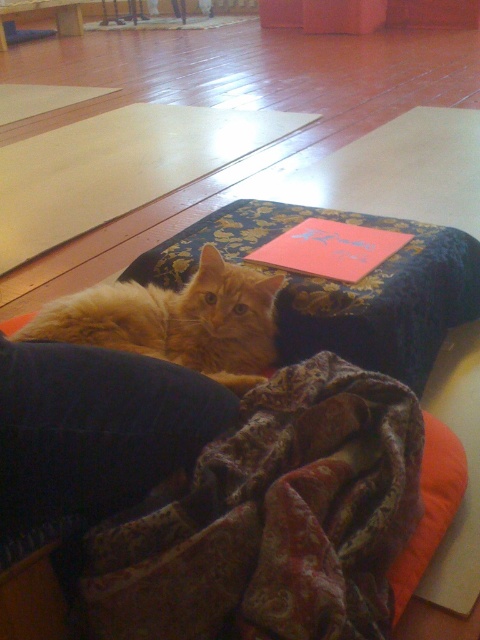
Between orange fabric pillow at lower right and smooth red paper at center, which one has less height?

Standing shorter between the two is smooth red paper at center.

Is point (441, 492) closer to viewer compared to point (285, 248)?

Yes, point (441, 492) is closer to viewer.

Image resolution: width=480 pixels, height=640 pixels. Identify the location of orange fabric pillow at lower right. (430, 508).

Between fluffy orange cat at center and orange fabric pillow at lower right, which one has less height?

Standing shorter between the two is orange fabric pillow at lower right.

You are a GUI agent. You are given a task and a screenshot of the screen. Output one action in this format:
    pyautogui.click(x=<x>, y=<y>)
    Task: Click on the fluffy orange cat at center
    The width and height of the screenshot is (480, 640).
    Given the screenshot: What is the action you would take?
    pyautogui.click(x=176, y=321)

Who is taller, blue floral fabric yoga mat at center or fluffy orange cat at center?

blue floral fabric yoga mat at center

Who is more forward, (358, 346) or (249, 387)?

Positioned in front is point (249, 387).

Where is `blue floral fabric yoga mat at center`? blue floral fabric yoga mat at center is located at coordinates (342, 285).